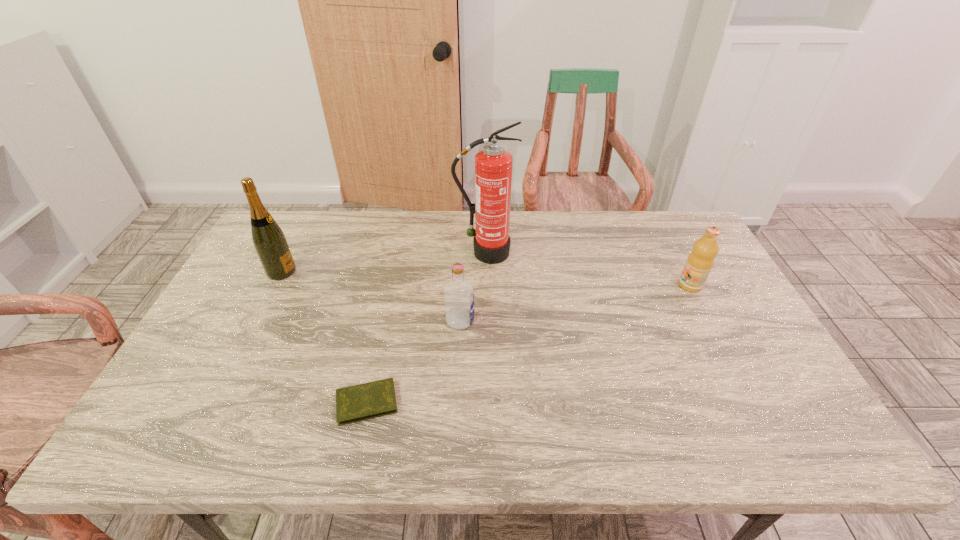
The height and width of the screenshot is (540, 960). I want to click on free spot between the shortest object and the fourth shortest object, so click(x=324, y=337).

Where is `unoccupied position between the vodka and the fourth shortest object`? This screenshot has width=960, height=540. unoccupied position between the vodka and the fourth shortest object is located at coordinates (371, 296).

This screenshot has width=960, height=540. In order to click on vacant area that lies between the rightmost object and the nearest object in this screenshot , I will do `click(529, 344)`.

Image resolution: width=960 pixels, height=540 pixels. What are the coordinates of `the closest object relative to the wine bottle` in the screenshot? It's located at (370, 400).

Identify the location of object that ranks as the third closest to the fruit juice. (370, 400).

I want to click on free location that satisfies the following two spatial constraints: 1. on the front-facing side of the leftmost object; 2. on the left side of the diary, so click(215, 402).

Image resolution: width=960 pixels, height=540 pixels. What are the coordinates of `vacant position in the image that satisfies the following two spatial constraints: 1. on the label of the second nearest object; 2. on the front side of the nearest object` in the screenshot? It's located at (x=457, y=402).

Identify the location of free spot that satisfies the following two spatial constraints: 1. on the front-facing side of the leftmost object; 2. on the left side of the shortest object. click(x=215, y=402).

At what (x,y) coordinates should I click in order to perform the action: click on blank space that satisfies the following two spatial constraints: 1. on the front-facing side of the fire extinguisher; 2. on the label of the vodka. Please return your answer as a coordinate pair (x, y). Image resolution: width=960 pixels, height=540 pixels. Looking at the image, I should click on (486, 321).

The image size is (960, 540). In order to click on blank area in the image that satisfies the following two spatial constraints: 1. on the front label of the rightmost object; 2. on the front side of the second object from left to right in this screenshot , I will do `click(751, 402)`.